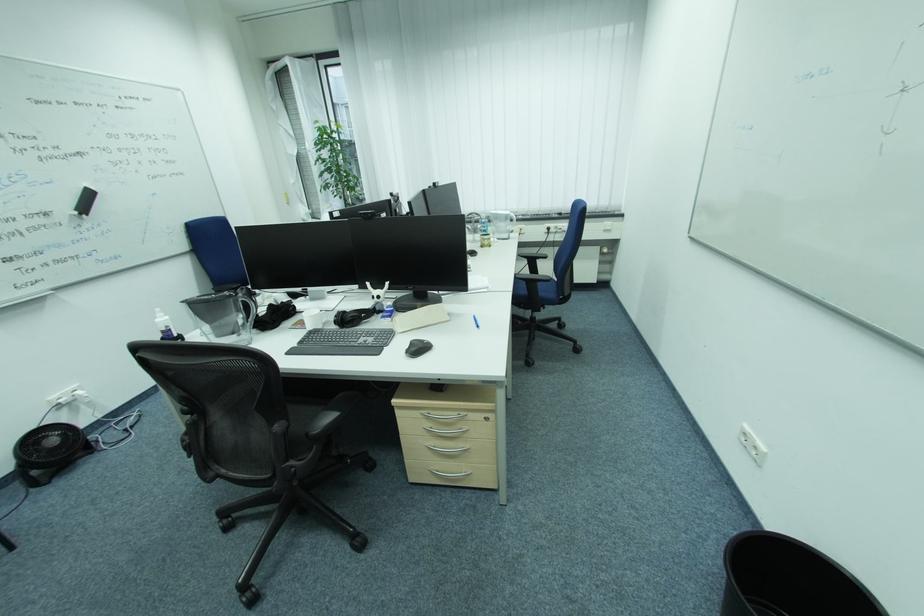
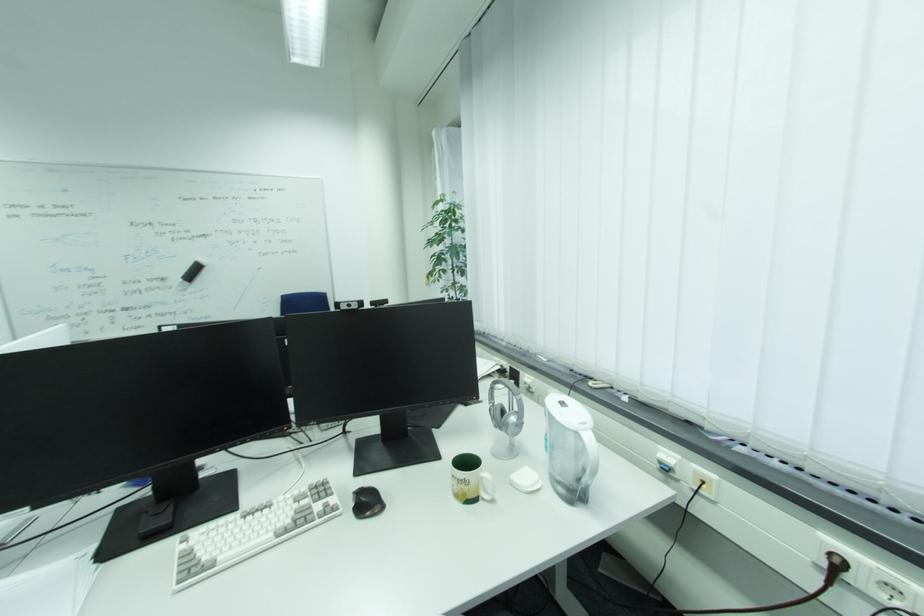
Locate, in the second image, the point that corresponds to (x=497, y=245) in the first image.

(490, 496)